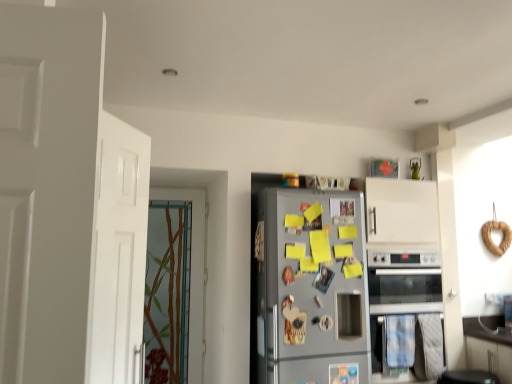
Question: Is satin silver fridge at center oriented away from satin silver oven at lower right?

Choices:
 (A) no
 (B) yes

Answer: (A)

Question: Does satin silver fridge at center have a smaller size compared to satin silver oven at lower right?

Choices:
 (A) no
 (B) yes

Answer: (A)

Question: From the image's perspective, is satin silver fridge at center over satin silver oven at lower right?

Choices:
 (A) no
 (B) yes

Answer: (B)

Question: From a real-world perspective, is satin silver fridge at center located higher than satin silver oven at lower right?

Choices:
 (A) no
 (B) yes

Answer: (B)

Question: From a real-world perspective, is satin silver fridge at center below satin silver oven at lower right?

Choices:
 (A) yes
 (B) no

Answer: (B)

Question: From the image's perspective, relative to satin silver fridge at center, is white matte door at left, marked as the first door in a front-to-back arrangement, above or below?

Choices:
 (A) below
 (B) above

Answer: (B)

Question: Considering the positions of white matte door at left, marked as the first door in a front-to-back arrangement, and satin silver fridge at center in the image, is white matte door at left, marked as the first door in a front-to-back arrangement, wider or thinner than satin silver fridge at center?

Choices:
 (A) wide
 (B) thin

Answer: (B)

Question: In terms of size, does white matte door at left, the 2th door from the back, appear bigger or smaller than satin silver fridge at center?

Choices:
 (A) small
 (B) big

Answer: (A)

Question: From a real-world perspective, relative to satin silver fridge at center, is white matte door at left, marked as the first door in a front-to-back arrangement, vertically above or below?

Choices:
 (A) below
 (B) above

Answer: (B)

Question: From their relative heights in the image, would you say translucent glass door at left, the second door from the front, is taller or shorter than baked wheat bagel at right?

Choices:
 (A) short
 (B) tall

Answer: (B)

Question: Considering their positions, is translucent glass door at left, the second door from the front, located in front of or behind baked wheat bagel at right?

Choices:
 (A) front
 (B) behind

Answer: (A)

Question: Considering the relative positions of translucent glass door at left, the first door in the back-to-front sequence, and baked wheat bagel at right in the image provided, is translucent glass door at left, the first door in the back-to-front sequence, to the left or to the right of baked wheat bagel at right?

Choices:
 (A) left
 (B) right

Answer: (A)

Question: Is translucent glass door at left, the second door from the front, inside or outside of baked wheat bagel at right?

Choices:
 (A) inside
 (B) outside

Answer: (B)

Question: Do you think translucent glass door at left, the second door from the front, is within white matte door at left, marked as the first door in a front-to-back arrangement, or outside of it?

Choices:
 (A) outside
 (B) inside

Answer: (A)

Question: From the image's perspective, is translucent glass door at left, the first door in the back-to-front sequence, located above or below white matte door at left, the 2th door from the back?

Choices:
 (A) below
 (B) above

Answer: (A)